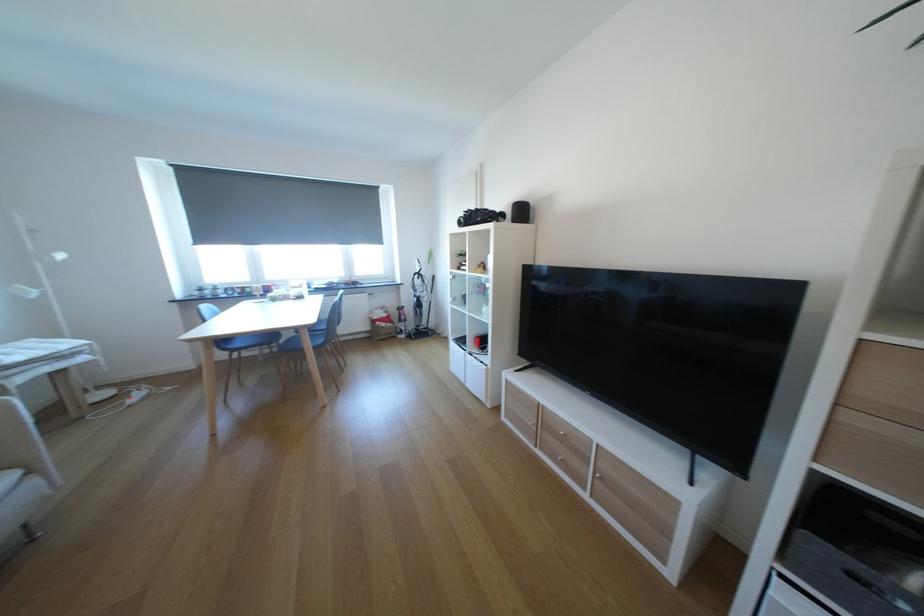
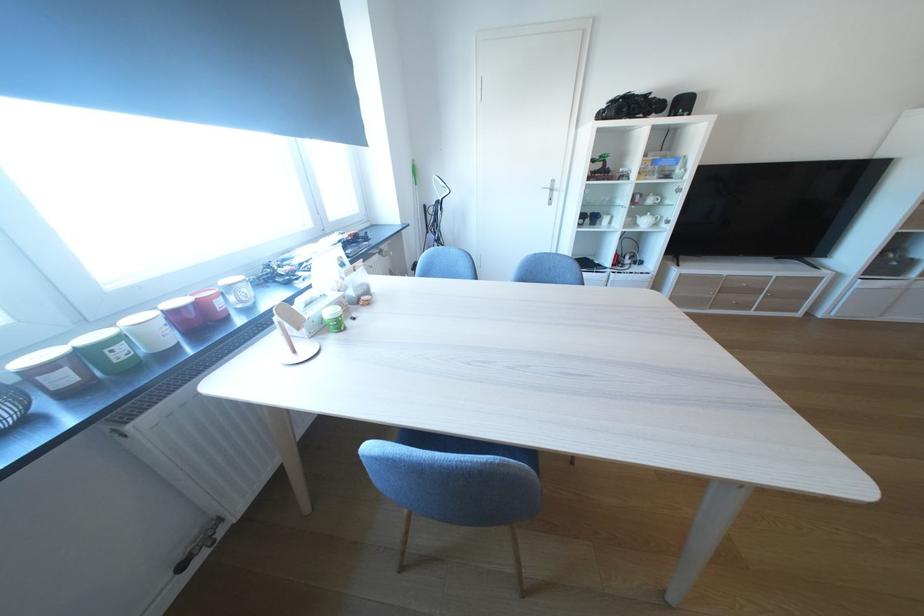
In the second image, find the point that corresponds to point (259, 292) in the first image.

(129, 354)